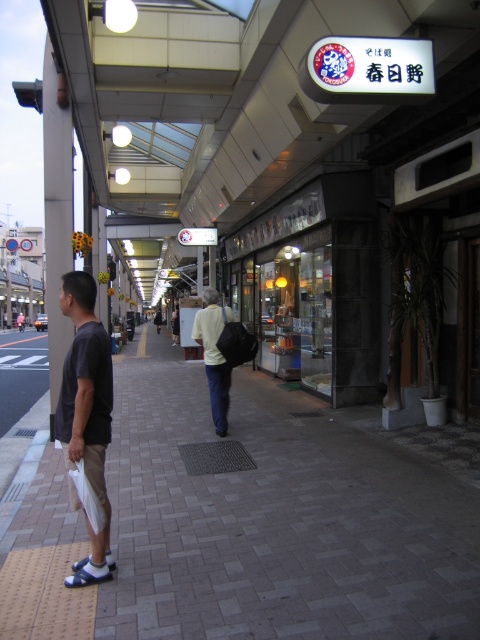
Who is positioned more to the right, dark gray t-shirt at left or light beige shirt at center?

light beige shirt at center is more to the right.

Which is below, dark gray t-shirt at left or light beige shirt at center?

dark gray t-shirt at left is lower down.

Is point (95, 465) closer to camera compared to point (223, 378)?

Yes.

The width and height of the screenshot is (480, 640). In order to click on dark gray t-shirt at left in this screenshot , I will do `click(86, 413)`.